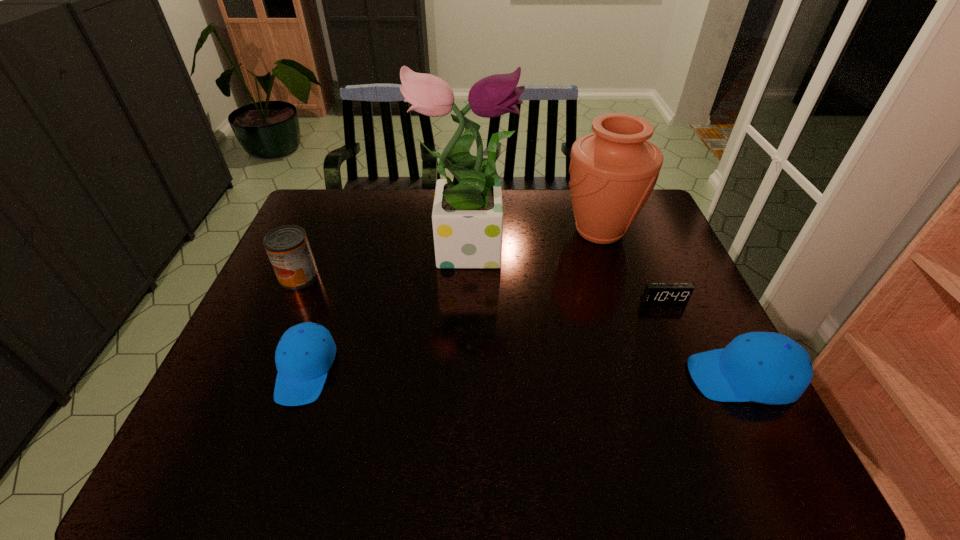
Where is `the left cap`? the left cap is located at coordinates (305, 353).

Where is `the shorter cap`? the shorter cap is located at coordinates click(x=305, y=353).

Where is `the taller cap`? the taller cap is located at coordinates (765, 367).

You are a GUI agent. You are given a task and a screenshot of the screen. Output one action in this format:
    pyautogui.click(x=<x>, y=<y>)
    Task: Click on the fourth tallest object
    
    Given the screenshot: What is the action you would take?
    pyautogui.click(x=765, y=367)

Identify the location of the tallest object. The image size is (960, 540). (467, 217).

Locate an element on the screen. The image size is (960, 540). the third object from left to right is located at coordinates (467, 217).

Image resolution: width=960 pixels, height=540 pixels. Identify the location of the second tallest object. (613, 171).

This screenshot has width=960, height=540. I want to click on the third tallest object, so click(x=288, y=248).

Locate an element on the screen. The width and height of the screenshot is (960, 540). alarm clock is located at coordinates (655, 293).

Where is `the shortest object`? Image resolution: width=960 pixels, height=540 pixels. the shortest object is located at coordinates (655, 293).